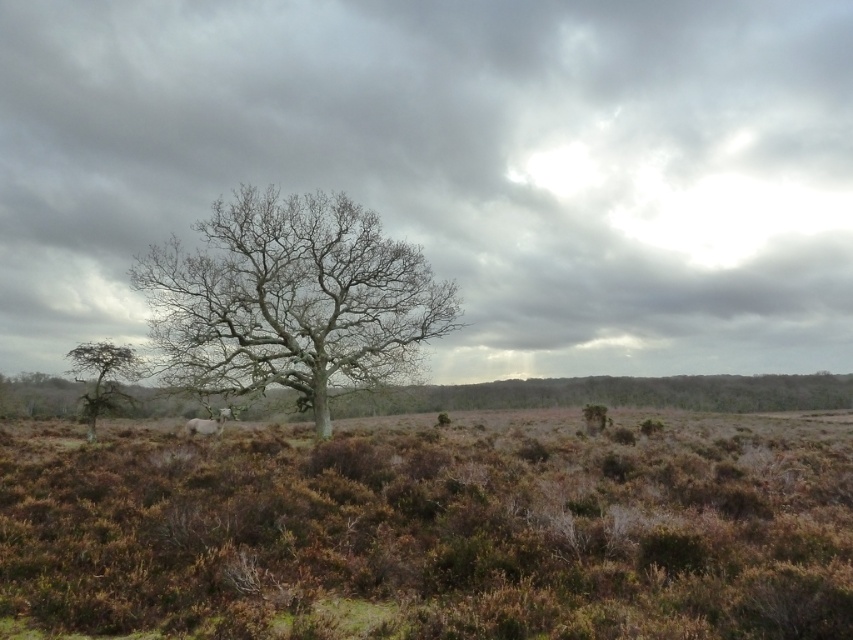
You are an astronomer analyzing the image. You need to locate the gray cloudy sky at center. What are the coordinates where it is positioned?

The gray cloudy sky at center is positioned at coordinates point [453,166].

You are an environmental scientist assessing the landscape. You need to determine which tree is taller between the bare wood tree at center and the green matte tree at lower left. Based on the scene, which one is taller?

The bare wood tree at center is taller than the green matte tree at lower left according to the description.